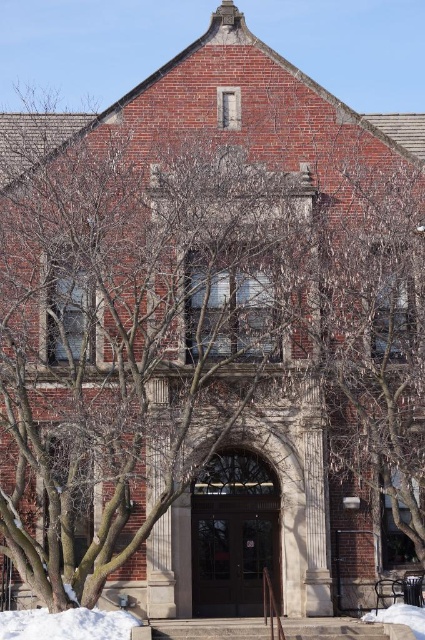
You are a delivery person trying to park your van. You see the white powdery snow at lower left and the white fluffy snow at lower right near the entrance of the building. Which area would be more suitable for parking your van?

The white powdery snow at lower left is larger in size than the white fluffy snow at lower right, so the white powdery snow at lower left area would be more suitable for parking your van since it has more space.

You are standing in front of the brick building and want to place a small decorative snowman exactly where the white powdery snow at lower left is located. What are the coordinates of the location where you should place the snowman?

The coordinates for the white powdery snow at lower left are at point (x=67, y=625).

You are standing in front of the brick building and notice two patches of snow. One is the white powdery snow at lower left and the other is the white fluffy snow at lower right. Which snow patch is positioned more to the left?

The white powdery snow at lower left is positioned more to the left than the white fluffy snow at lower right.